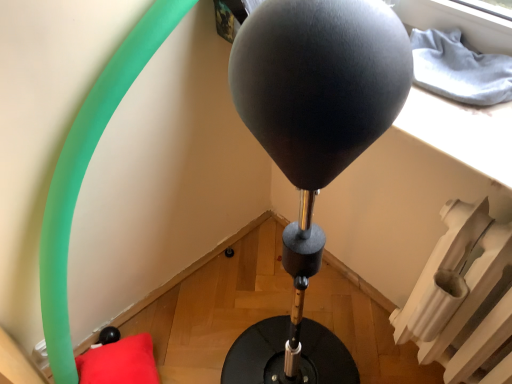
Question: From the image's perspective, is black matte balloon at center above or below red plush pillow at lower left?

Choices:
 (A) below
 (B) above

Answer: (B)

Question: Looking at the image, does black matte balloon at center seem bigger or smaller compared to red plush pillow at lower left?

Choices:
 (A) big
 (B) small

Answer: (A)

Question: Which object is the farthest from the white plastic radiator at lower right?

Choices:
 (A) red plush pillow at lower left
 (B) black matte balloon at center

Answer: (A)

Question: Estimate the real-world distances between objects in this image. Which object is closer to the red plush pillow at lower left?

Choices:
 (A) white plastic radiator at lower right
 (B) black matte balloon at center

Answer: (A)